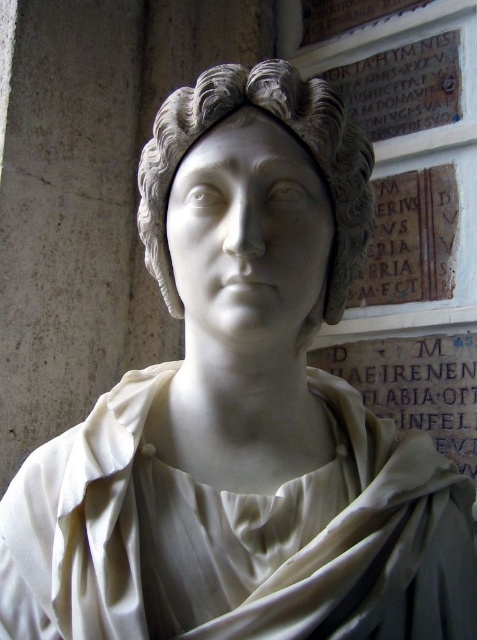
You are an art conservator examining the marble sculpture. You notice the white marble head at center and the white marble inscription at lower right. Which object is closer to the viewer?

The white marble head at center is closer to the viewer than the white marble inscription at lower right because it is positioned in front of it.

You are an archaeologist examining a historical site. You need to locate the white marble head at center. According to the coordinates provided, where would you find it?

The white marble head at center is located at coordinates point (289, 132).

You are an art conservator examining the white marble head at center and the white marble inscription at lower right. Which object is taller?

The white marble head at center is taller than the white marble inscription at lower right.